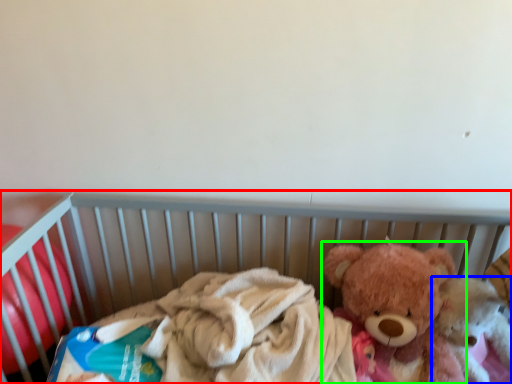
Question: Considering the real-world distances, which object is farthest from infant bed (highlighted by a red box)? teddy bear (highlighted by a blue box) or teddy bear (highlighted by a green box)?

Choices:
 (A) teddy bear
 (B) teddy bear

Answer: (A)